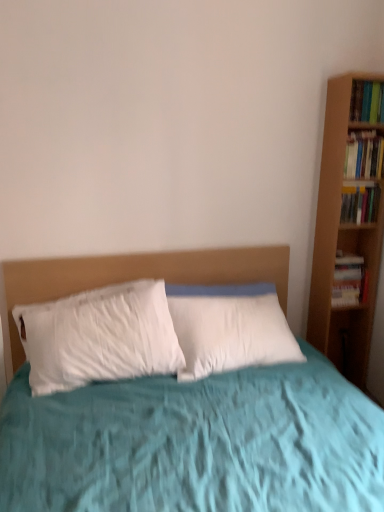
Where is `blank space situated above hardcover book at right, the third book ordered from the bottom (from a real-world perspective)`? The width and height of the screenshot is (384, 512). blank space situated above hardcover book at right, the third book ordered from the bottom (from a real-world perspective) is located at coordinates (367, 138).